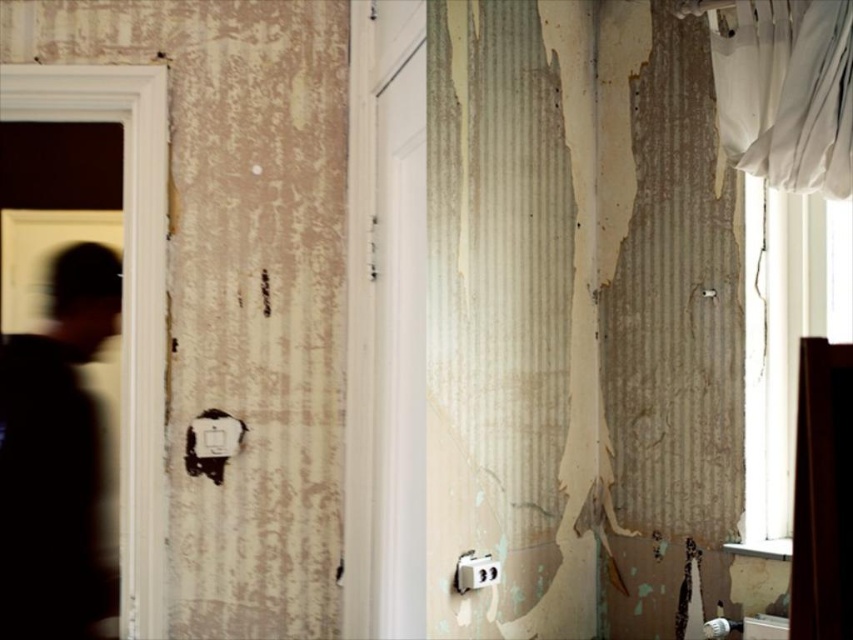
Question: Can you confirm if black matte person at left is bigger than white fabric curtain at upper right?

Choices:
 (A) yes
 (B) no

Answer: (B)

Question: Is black matte person at left smaller than white fabric curtain at upper right?

Choices:
 (A) no
 (B) yes

Answer: (B)

Question: Which point is farther to the camera?

Choices:
 (A) (728, 118)
 (B) (22, 576)

Answer: (B)

Question: Which of the following is the closest to the observer?

Choices:
 (A) (0, 554)
 (B) (776, 4)

Answer: (B)

Question: Is black matte person at left thinner than white fabric curtain at upper right?

Choices:
 (A) yes
 (B) no

Answer: (B)